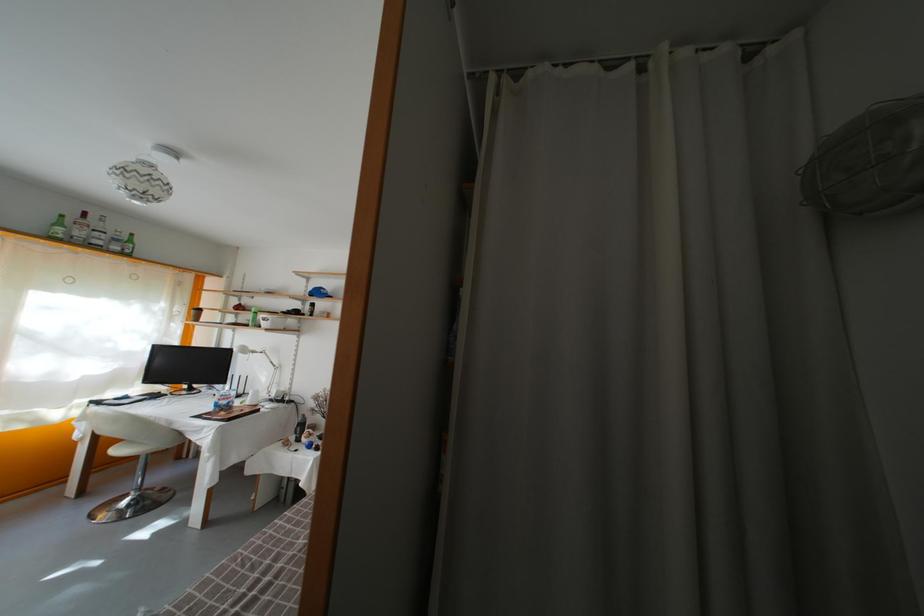
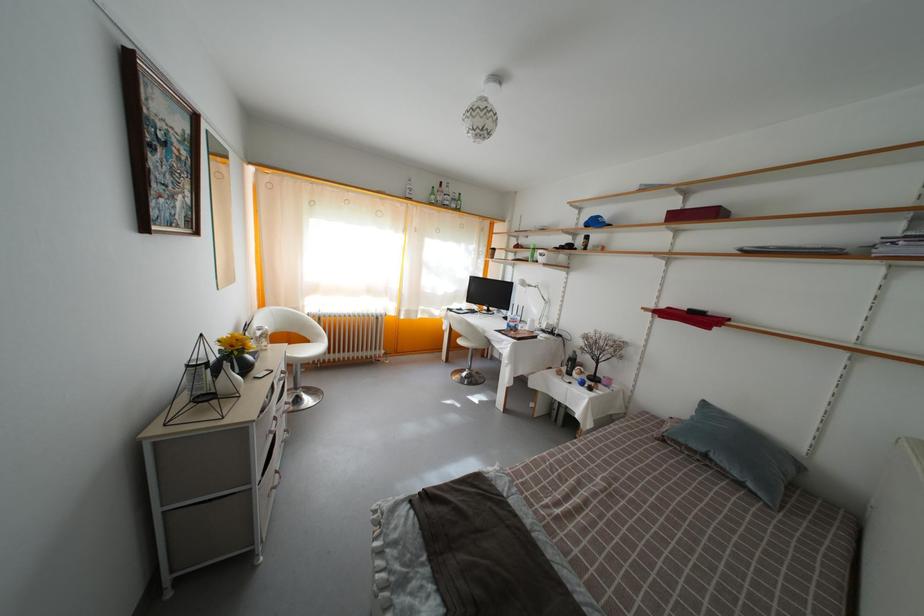
Question: I am providing you with two images of the same scene from different viewpoints. Which of the following objects are not visible in image2?

Choices:
 (A) green glass bottle
 (B) white chair sitting surface
 (C) red lidded box
 (D) none of these

Answer: (D)